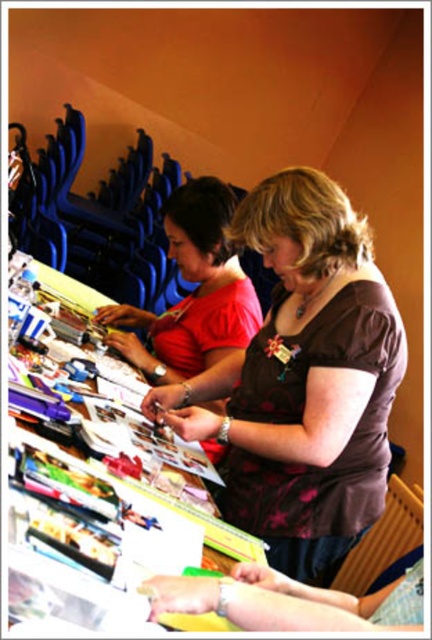
Question: Does brown textured blouse at center have a smaller size compared to matte red blouse at center?

Choices:
 (A) yes
 (B) no

Answer: (B)

Question: Which object is farther from the camera taking this photo?

Choices:
 (A) matte red blouse at center
 (B) wooden table at center
 (C) brown textured blouse at center

Answer: (A)

Question: Is brown textured blouse at center smaller than wooden table at center?

Choices:
 (A) yes
 (B) no

Answer: (B)

Question: Which object is positioned closest to the brown textured blouse at center?

Choices:
 (A) wooden table at center
 (B) matte red blouse at center

Answer: (A)

Question: Which is farther from the matte red blouse at center?

Choices:
 (A) brown textured blouse at center
 (B) wooden table at center

Answer: (B)

Question: Can you confirm if brown textured blouse at center is positioned below matte red blouse at center?

Choices:
 (A) yes
 (B) no

Answer: (A)